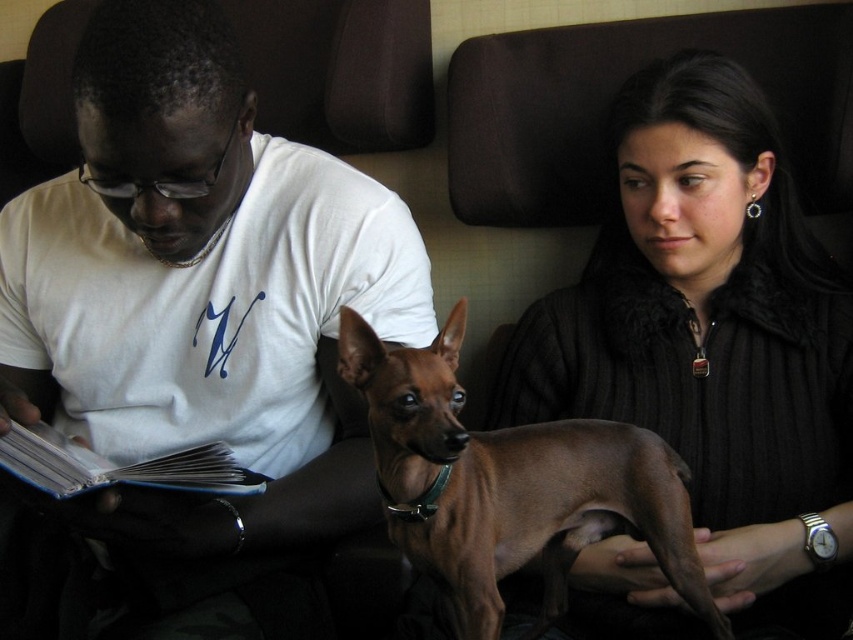
Locate an element on the screen. Image resolution: width=853 pixels, height=640 pixels. brown shiny dog at center is located at coordinates (509, 484).

Where is `brown shiny dog at center`? Image resolution: width=853 pixels, height=640 pixels. brown shiny dog at center is located at coordinates (509, 484).

Consider the image. Who is positioned more to the right, matte white shirt at center or blue hardcover book at left?

Positioned to the right is matte white shirt at center.

Does matte white shirt at center have a larger size compared to blue hardcover book at left?

Correct, matte white shirt at center is larger in size than blue hardcover book at left.

What are the coordinates of `matte white shirt at center` in the screenshot? It's located at (200, 320).

At what (x,y) coordinates should I click in order to perform the action: click on matte white shirt at center. Please return your answer as a coordinate pair (x, y). Looking at the image, I should click on coord(200,320).

Does smooth black coat at center lie in front of blue hardcover book at left?

No, it is behind blue hardcover book at left.

Can you confirm if smooth black coat at center is smaller than blue hardcover book at left?

Actually, smooth black coat at center might be larger than blue hardcover book at left.

Does point (653, 188) lie behind point (192, 468)?

Yes.

In order to click on smooth black coat at center in this screenshot , I will do [711, 339].